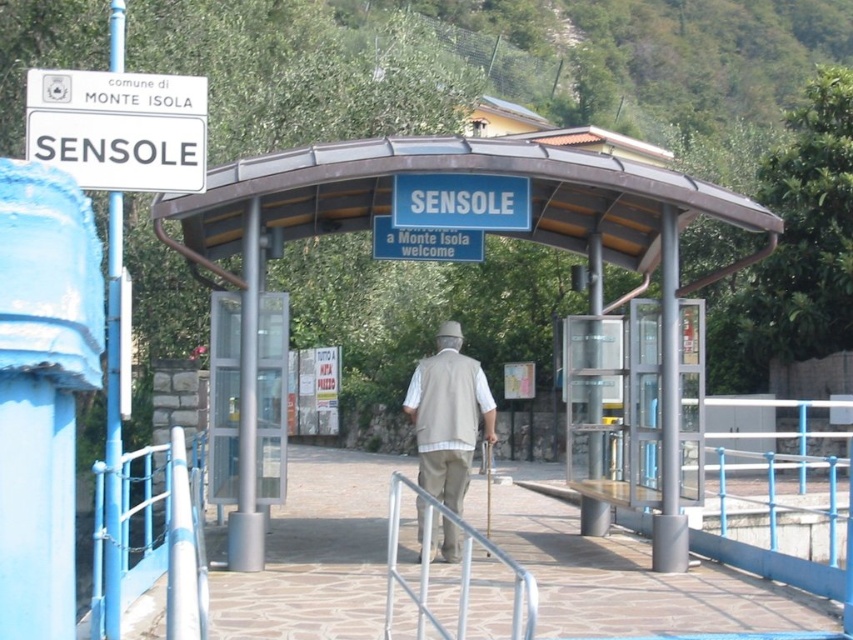
Who is higher up, metallic silver bus stop at center or beige fabric vest at center?

metallic silver bus stop at center is above.

Who is lower down, metallic silver bus stop at center or beige fabric vest at center?

beige fabric vest at center is lower down.

You are a GUI agent. You are given a task and a screenshot of the screen. Output one action in this format:
    pyautogui.click(x=<x>, y=<y>)
    Task: Click on the metallic silver bus stop at center
    Image resolution: width=853 pixels, height=640 pixels.
    Given the screenshot: What is the action you would take?
    pyautogui.click(x=486, y=230)

Does white plastic sign at upper left have a greater width compared to beige fabric vest at center?

Yes.

Can you confirm if white plastic sign at upper left is positioned to the right of beige fabric vest at center?

No, white plastic sign at upper left is not to the right of beige fabric vest at center.

Does point (144, 189) come farther from viewer compared to point (432, 403)?

No, (144, 189) is closer to viewer.

What are the coordinates of `white plastic sign at upper left` in the screenshot? It's located at (119, 129).

Does point (460, 330) come closer to viewer compared to point (518, 572)?

No, it is behind (518, 572).

Can you confirm if beige fabric vest at center is smaller than silver metallic railing at center?

Incorrect, beige fabric vest at center is not smaller in size than silver metallic railing at center.

Describe the element at coordinates (448, 416) in the screenshot. I see `beige fabric vest at center` at that location.

You are a GUI agent. You are given a task and a screenshot of the screen. Output one action in this format:
    pyautogui.click(x=<x>, y=<y>)
    Task: Click on the beige fabric vest at center
    This screenshot has height=640, width=853.
    Given the screenshot: What is the action you would take?
    pyautogui.click(x=448, y=416)